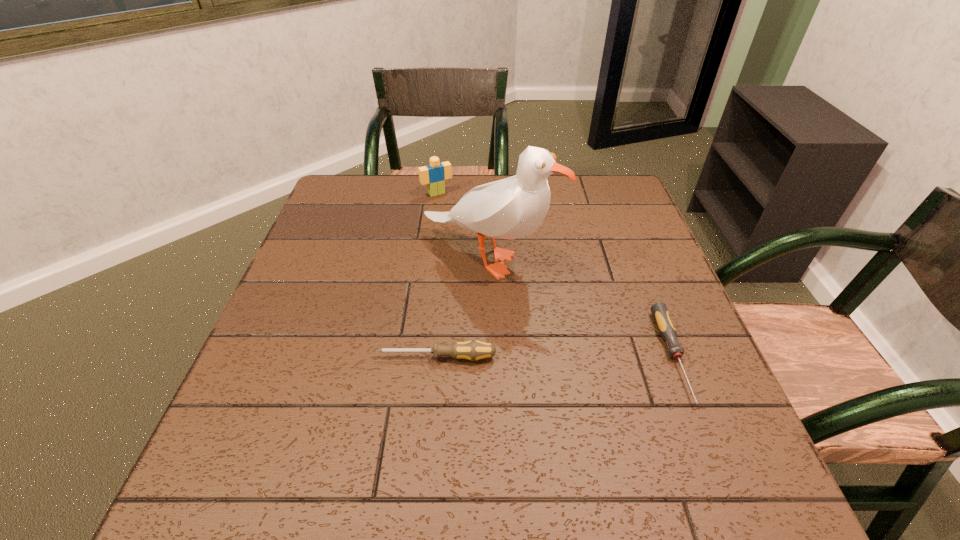
Identify the location of vacant area that lies between the rightmost object and the left screwdriver. click(x=555, y=357).

Image resolution: width=960 pixels, height=540 pixels. I want to click on unoccupied position between the shortest object and the Lego, so click(x=555, y=275).

The image size is (960, 540). I want to click on free space between the second farthest object and the third tallest object, so click(x=462, y=307).

Locate an element on the screen. This screenshot has height=540, width=960. unoccupied position between the taller screwdriver and the rightmost object is located at coordinates (555, 357).

You are a GUI agent. You are given a task and a screenshot of the screen. Output one action in this format:
    pyautogui.click(x=<x>, y=<y>)
    Task: Click on the free spot between the left screwdriver and the tallest object
    This screenshot has height=540, width=960.
    Given the screenshot: What is the action you would take?
    pyautogui.click(x=462, y=307)

Find the location of a particular element. This screenshot has width=960, height=540. vacant region between the rightmost object and the second shortest object is located at coordinates (555, 357).

I want to click on object that can be found as the closest to the tallest object, so click(x=435, y=174).

Identify the location of object that is the third closest to the rightmost object. (435, 174).